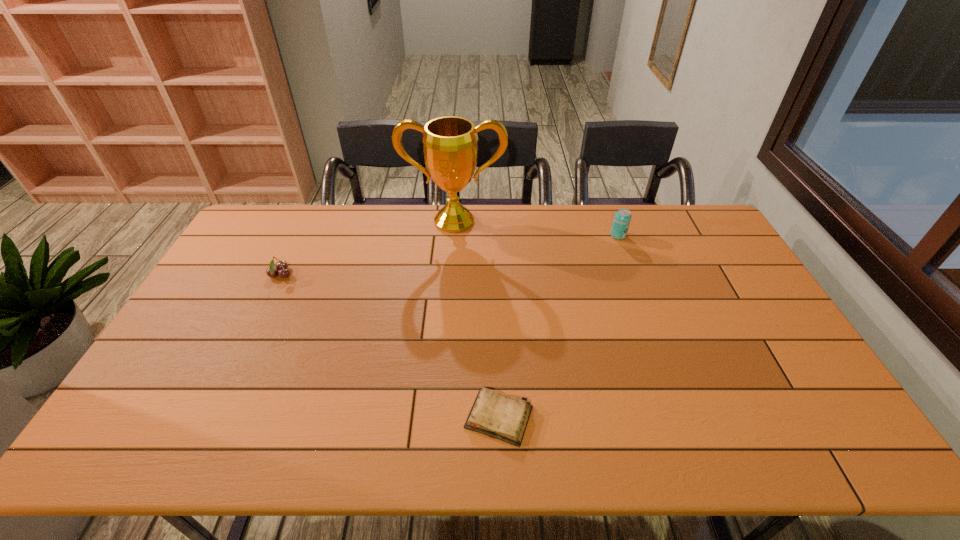
Where is `vacant space that's between the third farthest object and the beer can`? vacant space that's between the third farthest object and the beer can is located at coordinates (449, 255).

Find the location of `vacant region between the diary and the third tallest object`. vacant region between the diary and the third tallest object is located at coordinates (390, 347).

Find the location of a particular element. The image size is (960, 540). vacant area that lies between the rightmost object and the cherry is located at coordinates (449, 255).

The height and width of the screenshot is (540, 960). In order to click on vacant point located between the tallest object and the third shortest object in this screenshot , I will do (x=536, y=228).

Image resolution: width=960 pixels, height=540 pixels. In order to click on free space between the third shortest object and the cherry in this screenshot , I will do `click(449, 255)`.

Find the location of `empty location between the tallest object and the rightmost object`. empty location between the tallest object and the rightmost object is located at coordinates (536, 228).

At what (x,y) coordinates should I click in order to perform the action: click on free space between the beer can and the third tallest object. Please return your answer as a coordinate pair (x, y). This screenshot has height=540, width=960. Looking at the image, I should click on (449, 255).

Where is `vacant space that is in between the second shortest object and the tallest object`? vacant space that is in between the second shortest object and the tallest object is located at coordinates (368, 248).

You are a GUI agent. You are given a task and a screenshot of the screen. Output one action in this format:
    pyautogui.click(x=<x>, y=<y>)
    Task: Click on the free spot between the tallest object and the shortest object
    This screenshot has height=540, width=960.
    Given the screenshot: What is the action you would take?
    pyautogui.click(x=476, y=319)

Where is `free spot between the leftmost object and the award`? free spot between the leftmost object and the award is located at coordinates (368, 248).